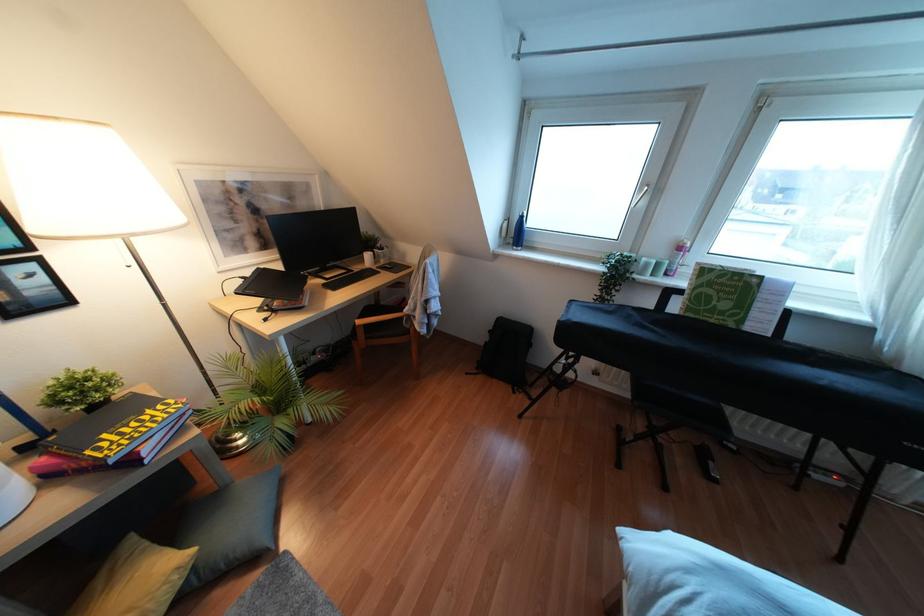
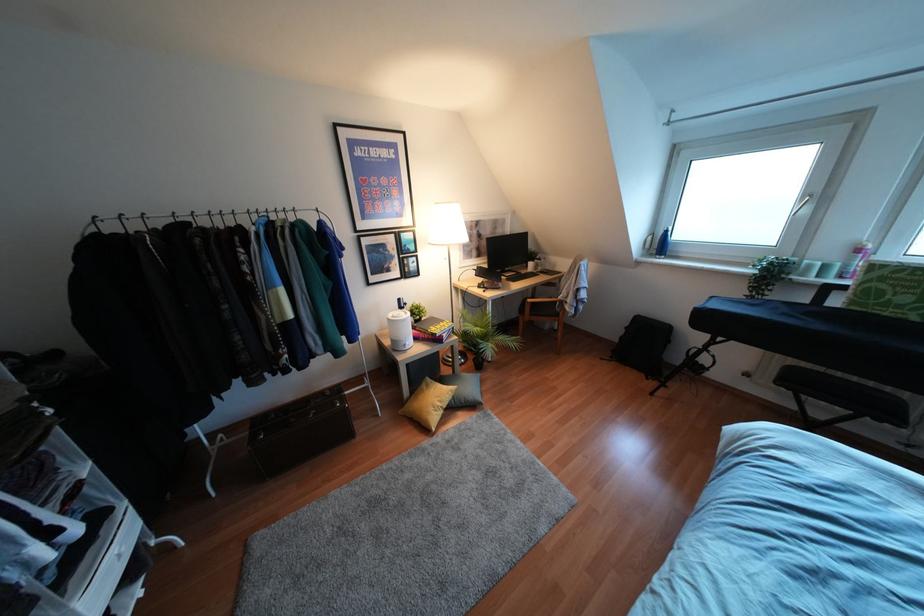
The point at (149, 411) is marked in the first image. Where is the corresponding point in the second image?

(441, 323)